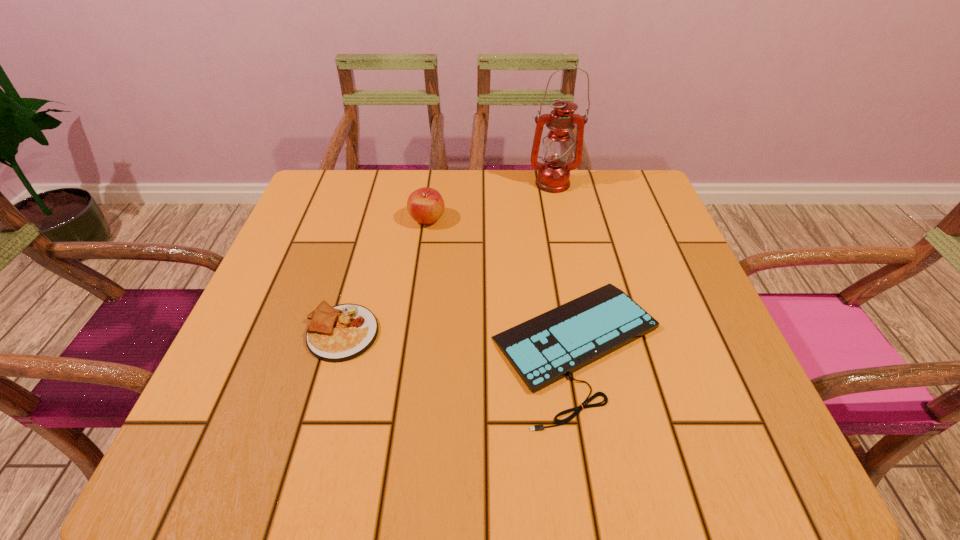
At what (x,y) coordinates should I click in order to perform the action: click on vacant space that's between the third shortest object and the oil lamp. Please return your answer as a coordinate pair (x, y). The image size is (960, 540). Looking at the image, I should click on (490, 201).

Where is `free space between the computer keyboard and the second object from left to right`? This screenshot has height=540, width=960. free space between the computer keyboard and the second object from left to right is located at coordinates (502, 284).

At what (x,y) coordinates should I click in order to perform the action: click on vacant area between the second object from left to right and the tallest object. Please return your answer as a coordinate pair (x, y). Looking at the image, I should click on (490, 201).

In order to click on object that is the third closest one to the leftmost object in this screenshot , I will do `click(553, 176)`.

Point out which object is positioned as the third nearest to the shortest object. Please provide its 2D coordinates. Your answer should be formatted as a tuple, i.e. [(x, y)], where the tuple contains the x and y coordinates of a point satisfying the conditions above.

[(553, 176)]

At what (x,y) coordinates should I click in order to perform the action: click on free location that satisfies the following two spatial constraints: 1. on the front side of the apple; 2. on the left side of the shortest object. Please return your answer as a coordinate pair (x, y). The height and width of the screenshot is (540, 960). Looking at the image, I should click on (410, 347).

This screenshot has width=960, height=540. Identify the location of free space that satisfies the following two spatial constraints: 1. on the back side of the shortest object; 2. on the left side of the tallest object. coord(546,184).

Locate an element on the screen. Image resolution: width=960 pixels, height=540 pixels. free space that satisfies the following two spatial constraints: 1. on the back side of the second shortest object; 2. on the right side of the oil lamp is located at coordinates (383, 184).

You are a GUI agent. You are given a task and a screenshot of the screen. Output one action in this format:
    pyautogui.click(x=<x>, y=<y>)
    Task: Click on the vacant space that satisfies the following two spatial constraints: 1. on the back side of the omelet; 2. on the right side of the third nearest object
    The height and width of the screenshot is (540, 960).
    Given the screenshot: What is the action you would take?
    pyautogui.click(x=373, y=219)